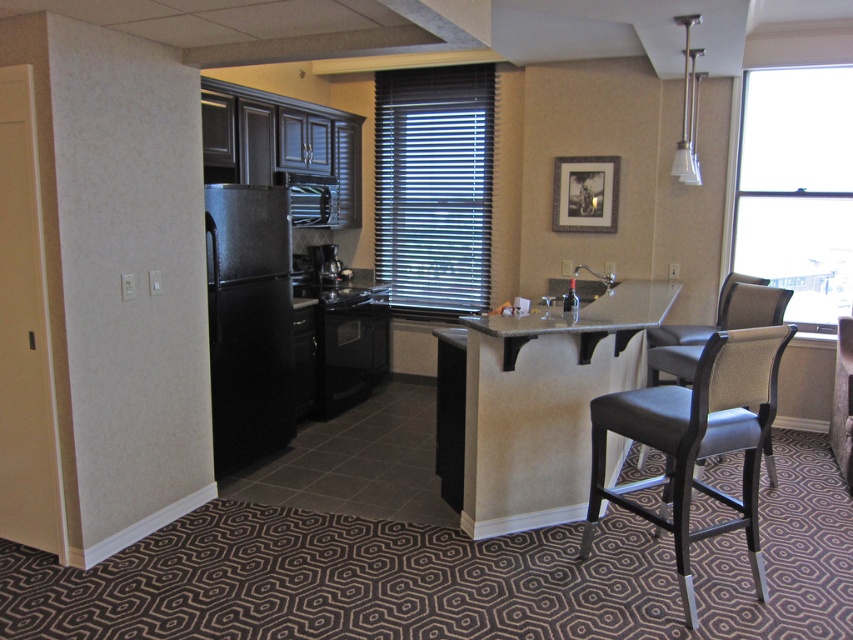
Question: Can you confirm if black leather bar stool at center is thinner than granite/textured counter top at center?

Choices:
 (A) yes
 (B) no

Answer: (A)

Question: Which point is closer to the camera?

Choices:
 (A) dark gray fabric chair at right
 (B) black leather bar stool at center
 (C) silver metallic blinds at center
 (D) granite countertop at center

Answer: (B)

Question: Can you confirm if dark gray fabric chair at right is positioned to the left of satin black coffee machine at center?

Choices:
 (A) yes
 (B) no

Answer: (B)

Question: Is granite countertop at center to the right of black leather bar stool at center from the viewer's perspective?

Choices:
 (A) yes
 (B) no

Answer: (B)

Question: Which object is closer to the camera taking this photo?

Choices:
 (A) dark gray fabric chair at right
 (B) black leather bar stool at center

Answer: (B)

Question: Which point is farther to the camera?

Choices:
 (A) (747, 298)
 (B) (616, 305)
 (C) (674, 388)
 (D) (485, 317)

Answer: (A)